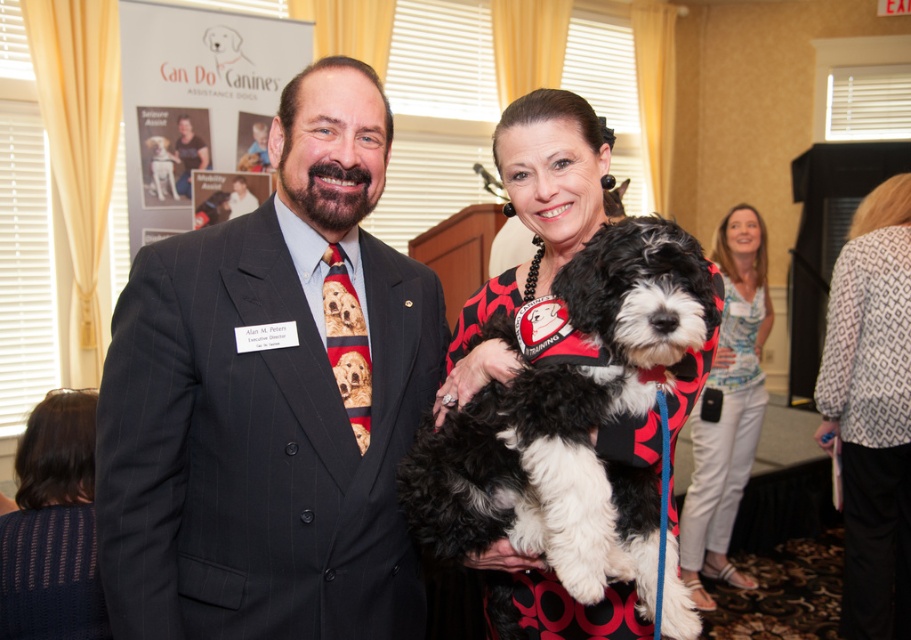
You are a photographer at a charity event. You need to position two guests for a photo. The guests are wearing a matte black suit at center and a light blue printed blouse at center. Based on their current positions, which guest should you ask to move to the right to create a balanced composition?

The matte black suit at center is positioned on the left side of light blue printed blouse at center. To balance the composition, you should ask the matte black suit at center to move to the right so that it aligns with the light blue printed blouse at center.